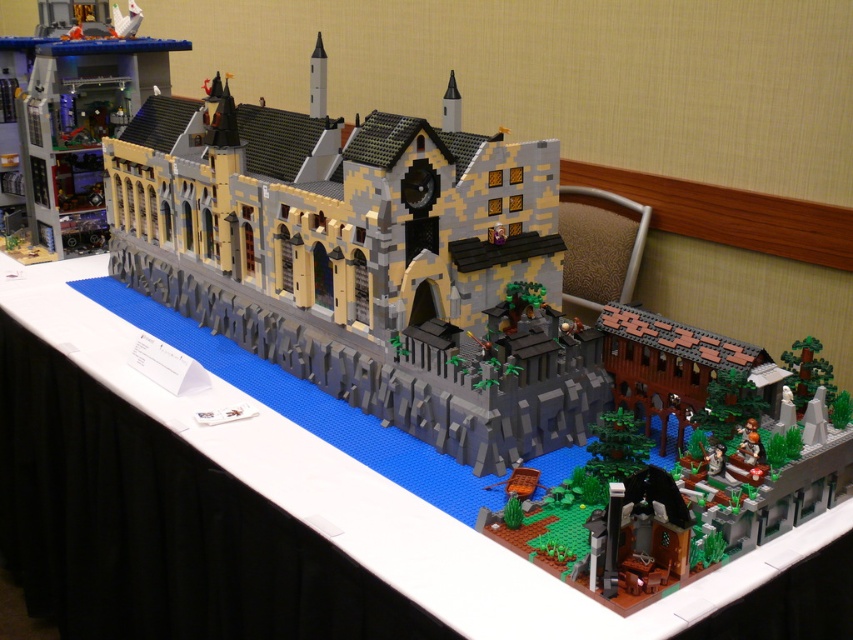
Question: Which of the following is the closest to the observer?

Choices:
 (A) smooth plastic castle at upper left
 (B) brown textured building at lower right
 (C) white matte table at center

Answer: (C)

Question: Does smooth plastic castle at upper left have a greater width compared to brown textured building at lower right?

Choices:
 (A) yes
 (B) no

Answer: (A)

Question: Does white matte table at center have a greater width compared to smooth plastic castle at upper left?

Choices:
 (A) yes
 (B) no

Answer: (A)

Question: Which point appears farthest from the camera in this image?

Choices:
 (A) (24, 100)
 (B) (187, 188)

Answer: (A)

Question: Can you confirm if smooth plastic castle at upper left is positioned above brown textured building at lower right?

Choices:
 (A) no
 (B) yes

Answer: (B)

Question: Among these objects, which one is farthest from the camera?

Choices:
 (A) brown textured building at lower right
 (B) white matte table at center
 (C) brick gray castle at center
 (D) smooth plastic castle at upper left

Answer: (D)